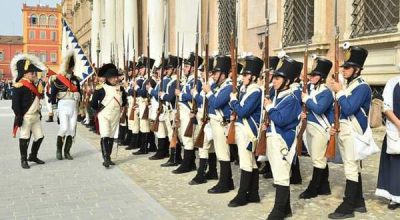
Where is `arched windows on top left corner`? This screenshot has width=400, height=220. arched windows on top left corner is located at coordinates (53, 24), (41, 19), (375, 218).